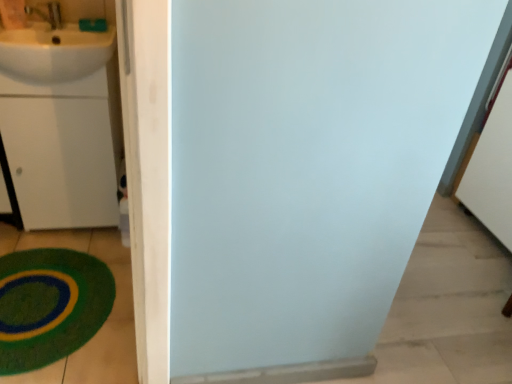
Measure the distance between white glossy sink at upper left and camera.

The distance of white glossy sink at upper left from camera is 1.45 meters.

This screenshot has height=384, width=512. I want to click on white glossy sink at upper left, so (54, 51).

Considering their positions, is green plush bath mat at lower left located in front of or behind white matte drawer at left?

Visually, green plush bath mat at lower left is located in front of white matte drawer at left.

Does green plush bath mat at lower left contain white matte drawer at left?

No, white matte drawer at left is not a part of green plush bath mat at lower left.

Can you confirm if green plush bath mat at lower left is thinner than white matte drawer at left?

In fact, green plush bath mat at lower left might be wider than white matte drawer at left.

How many degrees apart are the facing directions of green plush bath mat at lower left and white matte drawer at left?

They differ by 0.14 degrees in their facing directions.

Which point is more distant from viewer, (106,184) or (76,28)?

The point (106,184) is farther.

Is the surface of white matte drawer at left in direct contact with white glossy sink at upper left?

There is a gap between white matte drawer at left and white glossy sink at upper left.

From a real-world perspective, which object stands above the other?

white glossy sink at upper left.

Measure the distance from white matte drawer at left to white glossy sink at upper left.

A distance of 11.98 inches exists between white matte drawer at left and white glossy sink at upper left.

Considering the sizes of objects white glossy sink at upper left and green plush bath mat at lower left in the image provided, who is shorter, white glossy sink at upper left or green plush bath mat at lower left?

With less height is green plush bath mat at lower left.

Between white glossy sink at upper left and green plush bath mat at lower left, which one appears on the left side from the viewer's perspective?

green plush bath mat at lower left.

Is white glossy sink at upper left positioned beyond the bounds of green plush bath mat at lower left?

Yes, white glossy sink at upper left is not within green plush bath mat at lower left.

How different are the orientations of white glossy sink at upper left and green plush bath mat at lower left in degrees?

There is a 0.14-degree angle between the facing directions of white glossy sink at upper left and green plush bath mat at lower left.

Does white glossy sink at upper left turn towards white matte drawer at left?

Yes, white glossy sink at upper left is aimed at white matte drawer at left.

Is white matte drawer at left inside white glossy sink at upper left?

Actually, white matte drawer at left is outside white glossy sink at upper left.

From the image's perspective, which is above, white glossy sink at upper left or white matte drawer at left?

From the image's view, white glossy sink at upper left is above.

Between point (85, 225) and point (90, 268), which one is positioned behind?

The point (85, 225) is more distant.

How many degrees apart are the facing directions of white matte drawer at left and green plush bath mat at lower left?

They differ by 0.14 degrees in their facing directions.

Would you say white matte drawer at left is a long distance from green plush bath mat at lower left?

They are positioned close to each other.

Does white matte drawer at left have a greater width compared to green plush bath mat at lower left?

Incorrect, the width of white matte drawer at left does not surpass that of green plush bath mat at lower left.

Is point (26, 307) behind point (63, 48)?

Yes.

This screenshot has height=384, width=512. I want to click on sink above the green plush bath mat at lower left (from a real-world perspective), so click(54, 51).

From the image's perspective, which one is positioned higher, green plush bath mat at lower left or white glossy sink at upper left?

From the image's view, white glossy sink at upper left is above.

Identify the location of drawer that appears above the green plush bath mat at lower left (from a real-world perspective). The width and height of the screenshot is (512, 384). (61, 160).

I want to click on sink lying in front of the white matte drawer at left, so click(54, 51).

When comparing their distances from green plush bath mat at lower left, does white glossy sink at upper left or white matte drawer at left seem further?

Based on the image, white glossy sink at upper left appears to be further to green plush bath mat at lower left.

Looking at the image, which one is located closer to white glossy sink at upper left, white matte drawer at left or green plush bath mat at lower left?

white matte drawer at left lies closer to white glossy sink at upper left than the other object.

When comparing their distances from green plush bath mat at lower left, does white matte drawer at left or white glossy sink at upper left seem closer?

white matte drawer at left.

From the image, which object appears to be farther from white matte drawer at left, white glossy sink at upper left or green plush bath mat at lower left?

Among the two, green plush bath mat at lower left is located further to white matte drawer at left.

Based on their spatial positions, is green plush bath mat at lower left or white glossy sink at upper left closer to white matte drawer at left?

white glossy sink at upper left lies closer to white matte drawer at left than the other object.

From the image, which object appears to be nearer to white glossy sink at upper left, green plush bath mat at lower left or white matte drawer at left?

The object closer to white glossy sink at upper left is white matte drawer at left.

Image resolution: width=512 pixels, height=384 pixels. I want to click on drawer between white glossy sink at upper left and green plush bath mat at lower left from top to bottom, so click(x=61, y=160).